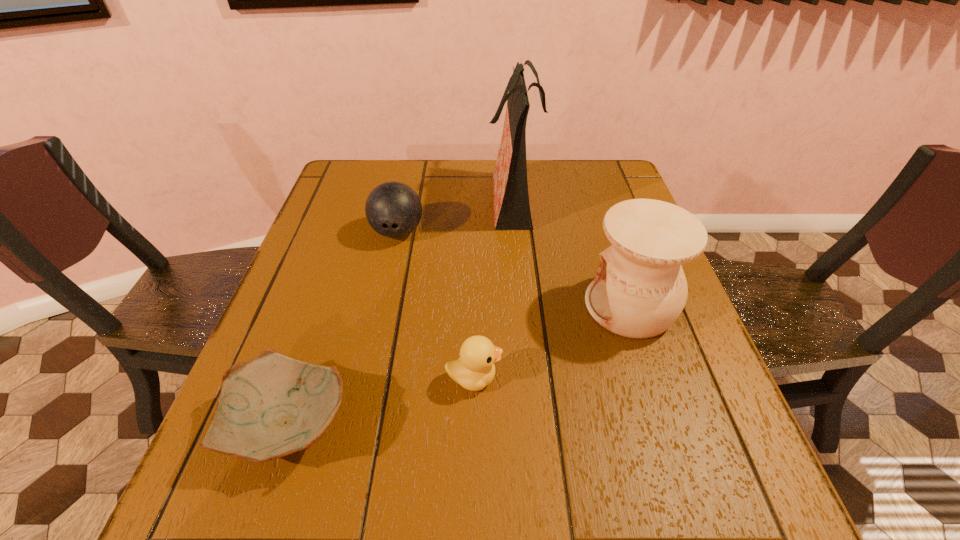
The height and width of the screenshot is (540, 960). I want to click on blank space located at the open side of the second tallest object, so click(424, 306).

This screenshot has height=540, width=960. Find the location of `free space located 0.130m at the open side of the second tallest object`. free space located 0.130m at the open side of the second tallest object is located at coordinates (525, 306).

The image size is (960, 540). Identify the location of vacant space located 0.070m at the open side of the second tallest object. (553, 306).

Identify the location of vacant position located 0.270m on the grip area of the third shortest object. (375, 335).

Locate an element on the screen. vacant space located 0.090m on the face of the fourth tallest object is located at coordinates (549, 377).

You are a GUI agent. You are given a task and a screenshot of the screen. Output one action in this format:
    pyautogui.click(x=<x>, y=<y>)
    Task: Click on the free region located on the back of the shorter pottery
    The width and height of the screenshot is (960, 540).
    Given the screenshot: What is the action you would take?
    pyautogui.click(x=314, y=353)

You are a GUI agent. You are given a task and a screenshot of the screen. Output one action in this format:
    pyautogui.click(x=<x>, y=<y>)
    Task: Click on the object that is at the far edge
    
    Given the screenshot: What is the action you would take?
    pyautogui.click(x=512, y=211)

Locate an element on the screen. Image resolution: width=960 pixels, height=540 pixels. object that is positioned at the near edge is located at coordinates (271, 406).

This screenshot has width=960, height=540. Identify the location of bowling ball that is at the left edge. (393, 209).

Where is `pottery that is at the left edge`? This screenshot has width=960, height=540. pottery that is at the left edge is located at coordinates (271, 406).